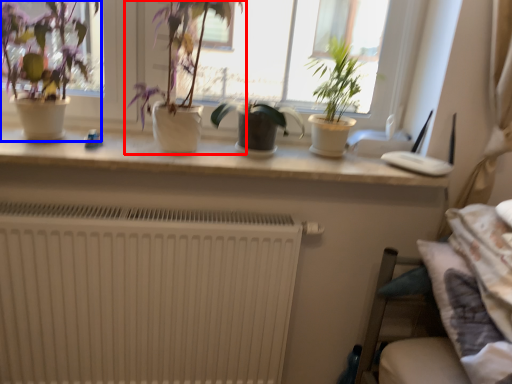
Question: Which of the following is the closest to the observer, houseplant (highlighted by a red box) or houseplant (highlighted by a blue box)?

Choices:
 (A) houseplant
 (B) houseplant

Answer: (A)